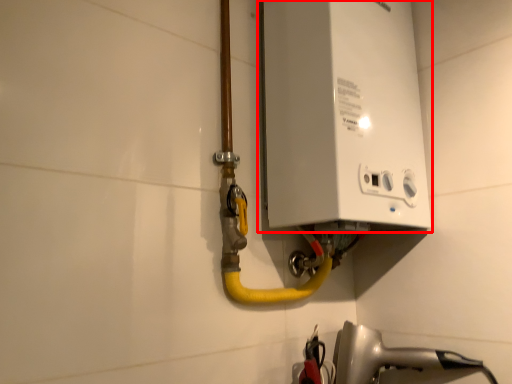
Question: In this image, where is appliance (annotated by the red box) located relative to plumbing fixture?

Choices:
 (A) left
 (B) right

Answer: (A)